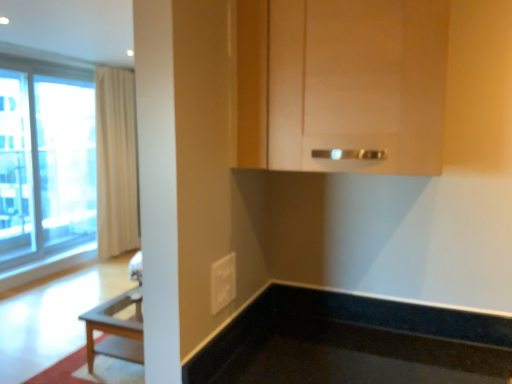
Question: From a real-world perspective, is beige fabric curtain at left located beneath white plastic electric outlet at lower center?

Choices:
 (A) yes
 (B) no

Answer: (B)

Question: Does beige fabric curtain at left have a lesser height compared to white plastic electric outlet at lower center?

Choices:
 (A) no
 (B) yes

Answer: (A)

Question: Is white plastic electric outlet at lower center inside beige fabric curtain at left?

Choices:
 (A) yes
 (B) no

Answer: (B)

Question: Does beige fabric curtain at left have a larger size compared to white plastic electric outlet at lower center?

Choices:
 (A) yes
 (B) no

Answer: (A)

Question: From a real-world perspective, is beige fabric curtain at left on white plastic electric outlet at lower center?

Choices:
 (A) yes
 (B) no

Answer: (A)

Question: Can you confirm if beige fabric curtain at left is positioned to the left of white plastic electric outlet at lower center?

Choices:
 (A) yes
 (B) no

Answer: (A)

Question: From a real-world perspective, is matte wood cabinet at upper center over white plastic electric outlet at lower center?

Choices:
 (A) no
 (B) yes

Answer: (B)

Question: Is white plastic electric outlet at lower center surrounded by matte wood cabinet at upper center?

Choices:
 (A) yes
 (B) no

Answer: (B)

Question: From a real-world perspective, is matte wood cabinet at upper center under white plastic electric outlet at lower center?

Choices:
 (A) no
 (B) yes

Answer: (A)

Question: Is matte wood cabinet at upper center further to camera compared to white plastic electric outlet at lower center?

Choices:
 (A) no
 (B) yes

Answer: (A)

Question: Is matte wood cabinet at upper center to the right of white plastic electric outlet at lower center from the viewer's perspective?

Choices:
 (A) yes
 (B) no

Answer: (A)

Question: Is matte wood cabinet at upper center oriented away from white plastic electric outlet at lower center?

Choices:
 (A) no
 (B) yes

Answer: (A)

Question: Does white plastic electric outlet at lower center have a smaller size compared to matte wood cabinet at upper center?

Choices:
 (A) no
 (B) yes

Answer: (B)